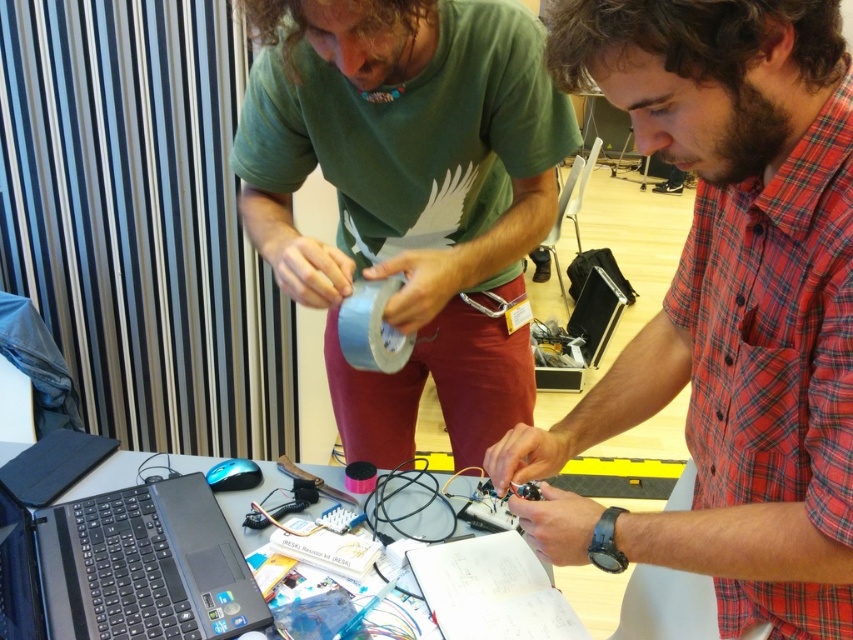
Question: Does black plastic table at center appear on the left side of black matte wire at center?

Choices:
 (A) no
 (B) yes

Answer: (B)

Question: Is red plaid shirt at center positioned before black plastic laptop at lower left?

Choices:
 (A) yes
 (B) no

Answer: (A)

Question: Which point is farther from the camera taking this photo?

Choices:
 (A) (370, 45)
 (B) (109, 541)
 (C) (310, 513)
 (D) (383, 506)

Answer: (D)

Question: Which of these objects is positioned farthest from the black matte wire at center?

Choices:
 (A) black plastic table at center
 (B) green matte t-shirt at center

Answer: (B)

Question: Which point is farther from the camera taking this photo?

Choices:
 (A) (340, 202)
 (B) (770, 481)
 (C) (96, 480)
 (D) (378, 516)

Answer: (A)

Question: Does red plaid shirt at center have a greater width compared to black plastic table at center?

Choices:
 (A) no
 (B) yes

Answer: (A)